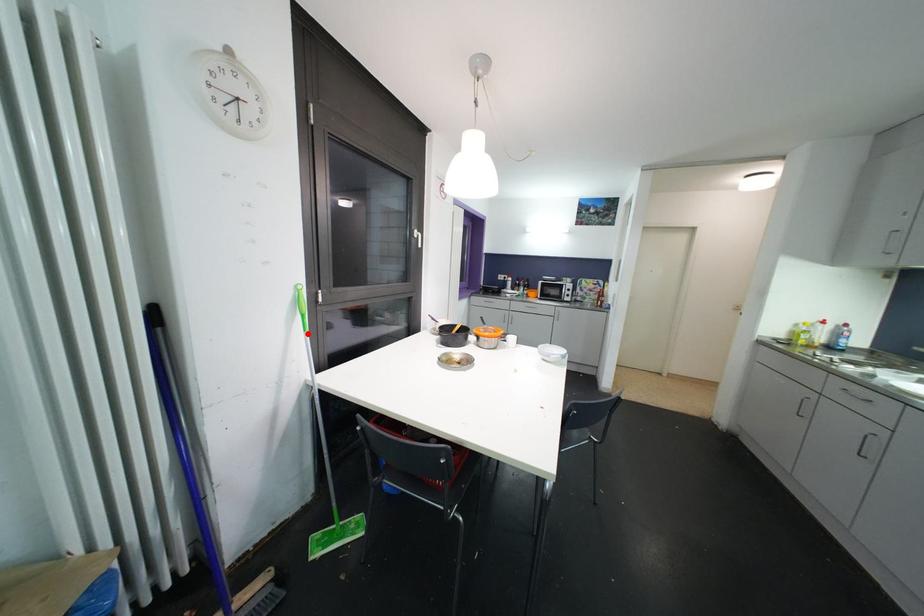
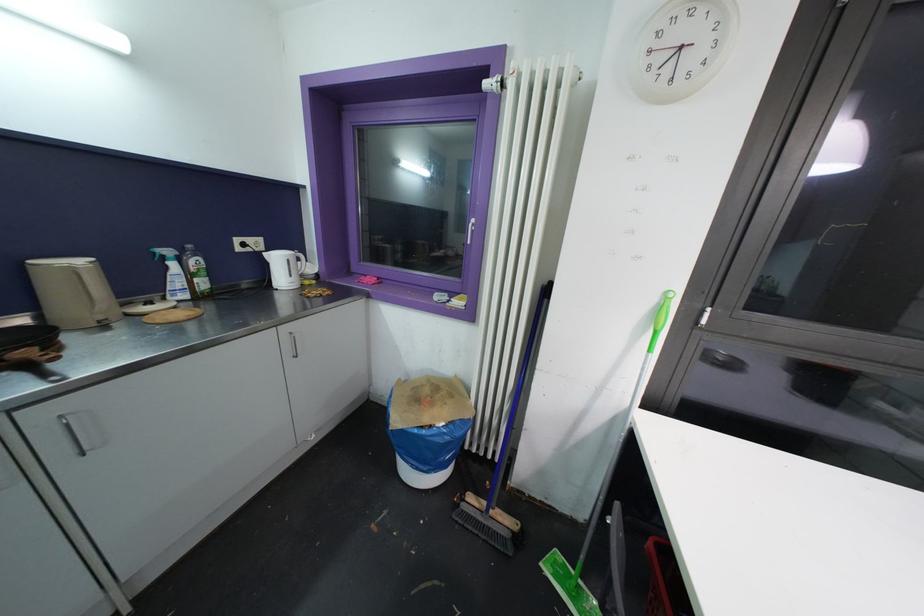
Question: I am providing you with two images of the same scene from different viewpoints. Image1 has a red point marked. In image2, the corresponding 3D location appears at what relative position? Reply with the corresponding letter.

Choices:
 (A) Closer
 (B) Farther

Answer: (B)